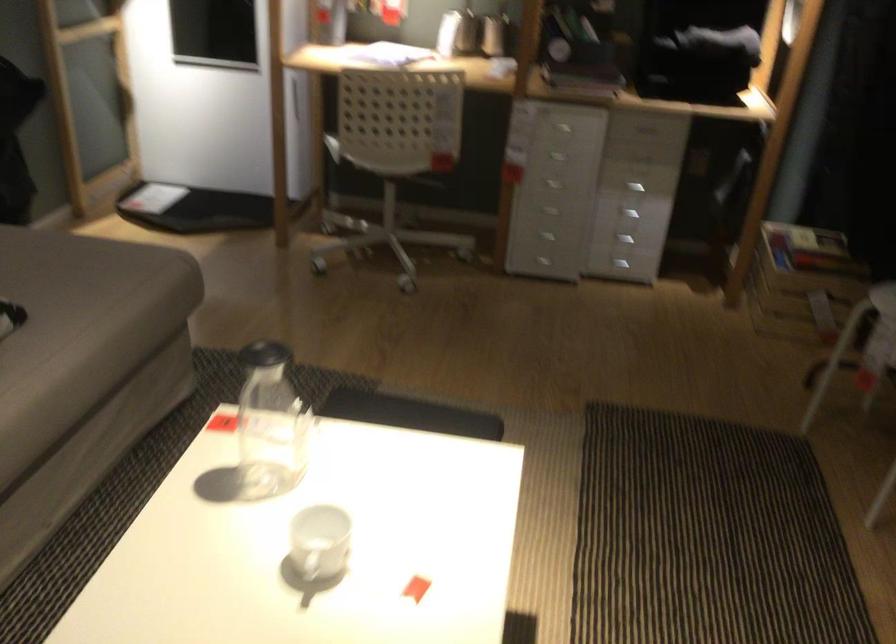
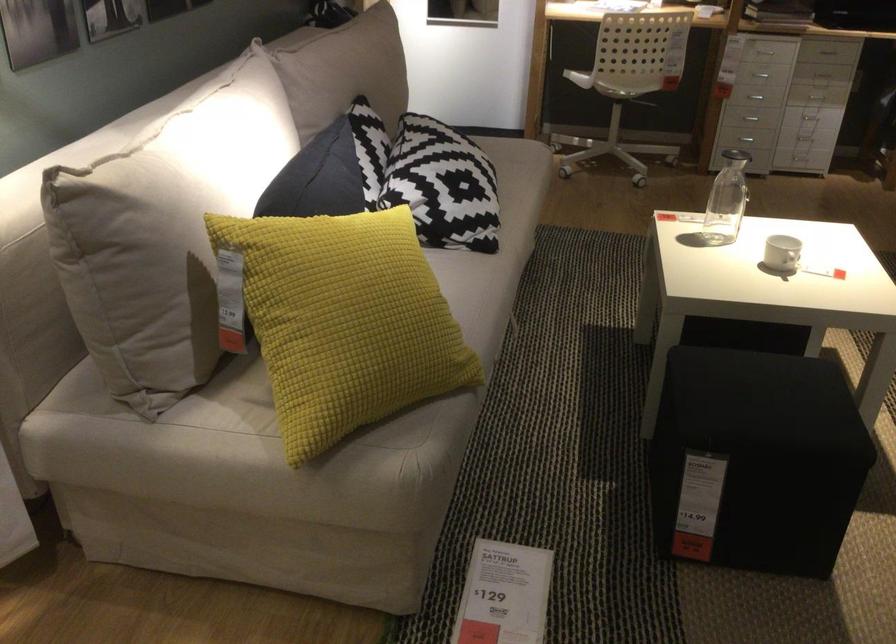
The point at (626, 154) is marked in the first image. Where is the corresponding point in the second image?

(826, 51)